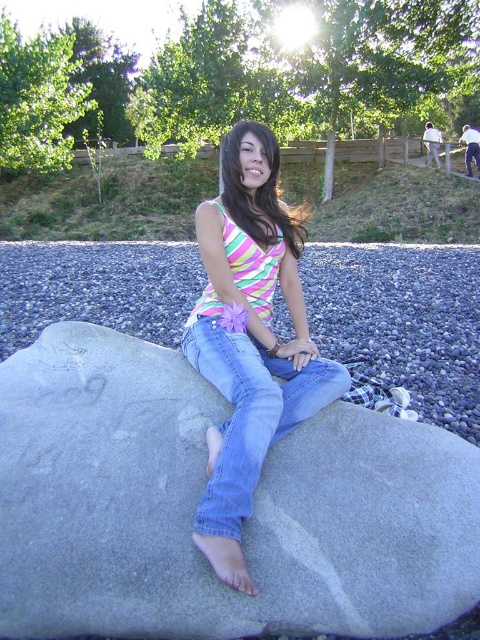
From the picture: Which of these two, gray smooth boulder at center or denim jeans at center, stands taller?

Standing taller between the two is gray smooth boulder at center.

Who is lower down, gray smooth boulder at center or denim jeans at center?

gray smooth boulder at center is lower down.

Locate an element on the screen. The width and height of the screenshot is (480, 640). gray smooth boulder at center is located at coordinates (197, 500).

Locate an element on the screen. The width and height of the screenshot is (480, 640). gray smooth boulder at center is located at coordinates (197, 500).

Between point (240, 552) and point (332, 400), which one is positioned behind?

Positioned behind is point (332, 400).

Is point (239, 474) more distant than point (215, 317)?

No, it is in front of (215, 317).

Where is `striped fabric tank top at center`? This screenshot has width=480, height=640. striped fabric tank top at center is located at coordinates (250, 339).

Between gray smooth boulder at center and striped fabric tank top at center, which one appears on the left side from the viewer's perspective?

From the viewer's perspective, gray smooth boulder at center appears more on the left side.

Is point (169, 532) behind point (251, 416)?

No.

The width and height of the screenshot is (480, 640). In order to click on gray smooth boulder at center in this screenshot , I will do `click(197, 500)`.